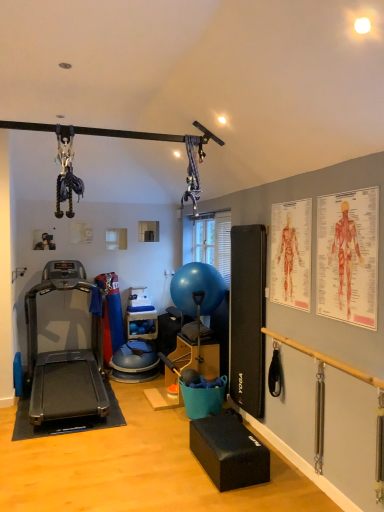
Question: Is blue rubber shelf at center closer to the viewer compared to anatomical chart at upper right, the second person positioned from the back?

Choices:
 (A) no
 (B) yes

Answer: (A)

Question: Is blue rubber shelf at center taller than anatomical chart at upper right, which is the first person from right to left?

Choices:
 (A) yes
 (B) no

Answer: (B)

Question: Is blue rubber shelf at center positioned with its back to anatomical chart at upper right, which is the first person from right to left?

Choices:
 (A) yes
 (B) no

Answer: (B)

Question: Does blue rubber shelf at center have a lesser height compared to anatomical chart at upper right, which is the first person from right to left?

Choices:
 (A) no
 (B) yes

Answer: (B)

Question: Does blue rubber shelf at center appear on the right side of anatomical chart at upper right, the second person positioned from the back?

Choices:
 (A) yes
 (B) no

Answer: (B)

Question: Visually, is anatomical chart at upper right, the second person positioned from the left, positioned to the left or to the right of black rubber treadmill at left?

Choices:
 (A) right
 (B) left

Answer: (A)

Question: Is anatomical chart at upper right, arranged as the first person when viewed from the front, bigger or smaller than black rubber treadmill at left?

Choices:
 (A) big
 (B) small

Answer: (B)

Question: Is anatomical chart at upper right, which is the first person from right to left, spatially inside black rubber treadmill at left, or outside of it?

Choices:
 (A) outside
 (B) inside

Answer: (A)

Question: Relative to black rubber treadmill at left, is anatomical chart at upper right, which is the first person from right to left, in front or behind?

Choices:
 (A) behind
 (B) front

Answer: (B)

Question: From a real-world perspective, relative to black rubber treadmill at left, is blue rubber shelf at center vertically above or below?

Choices:
 (A) below
 (B) above

Answer: (A)

Question: Is blue rubber shelf at center in front of or behind black rubber treadmill at left in the image?

Choices:
 (A) behind
 (B) front

Answer: (A)

Question: In terms of height, does blue rubber shelf at center look taller or shorter compared to black rubber treadmill at left?

Choices:
 (A) tall
 (B) short

Answer: (B)

Question: Do you think blue rubber shelf at center is within black rubber treadmill at left, or outside of it?

Choices:
 (A) inside
 (B) outside

Answer: (B)

Question: Do you think red paper human anatomy chart at upper right is within anatomical chart at upper right, the second person positioned from the left, or outside of it?

Choices:
 (A) inside
 (B) outside

Answer: (B)

Question: From the image's perspective, is red paper human anatomy chart at upper right above or below anatomical chart at upper right, the second person positioned from the left?

Choices:
 (A) below
 (B) above

Answer: (A)